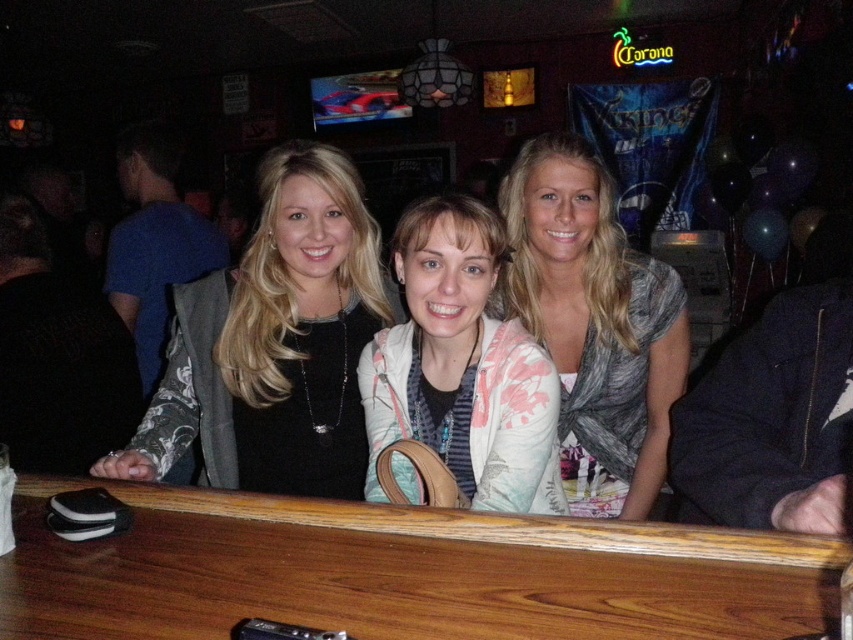
Question: Which of the following is the farthest from the observer?

Choices:
 (A) wooden table at center
 (B) gray textured scarf at center
 (C) pink floral cardigan at center
 (D) black matte vest at center

Answer: (B)

Question: Can you confirm if wooden table at center is positioned above pink floral cardigan at center?

Choices:
 (A) no
 (B) yes

Answer: (A)

Question: Is wooden table at center bigger than gray textured scarf at center?

Choices:
 (A) no
 (B) yes

Answer: (A)

Question: Estimate the real-world distances between objects in this image. Which object is closer to the pink floral cardigan at center?

Choices:
 (A) gray textured scarf at center
 (B) wooden table at center
 (C) black matte vest at center

Answer: (A)

Question: Which point is closer to the camera taking this photo?

Choices:
 (A) (428, 244)
 (B) (554, 353)

Answer: (A)

Question: Can you confirm if black matte vest at center is positioned above pink floral cardigan at center?

Choices:
 (A) yes
 (B) no

Answer: (A)